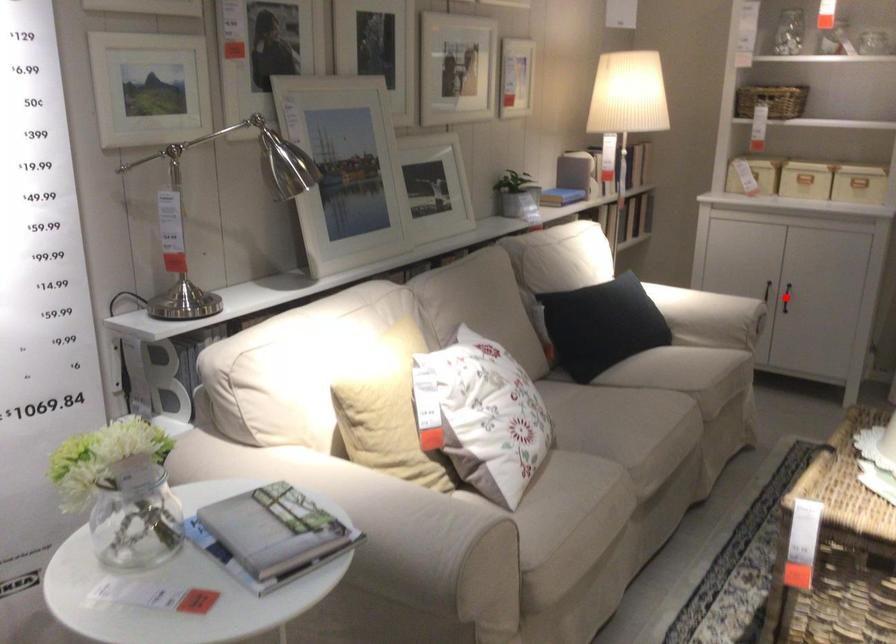
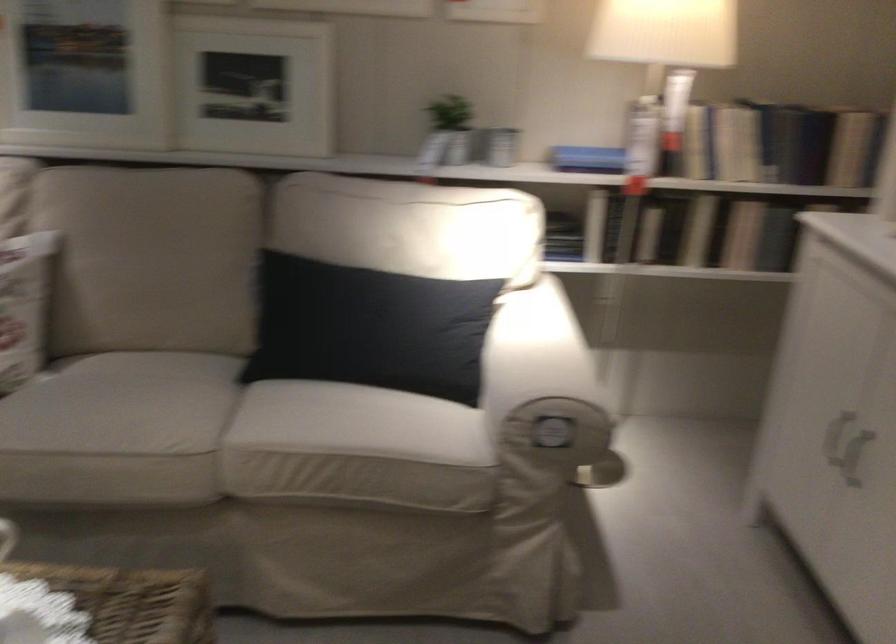
Question: I am providing you with two images of the same scene from different viewpoints. A red point is marked on the first image. Is the red point's position out of view in image 2?

Choices:
 (A) Yes
 (B) No

Answer: (A)